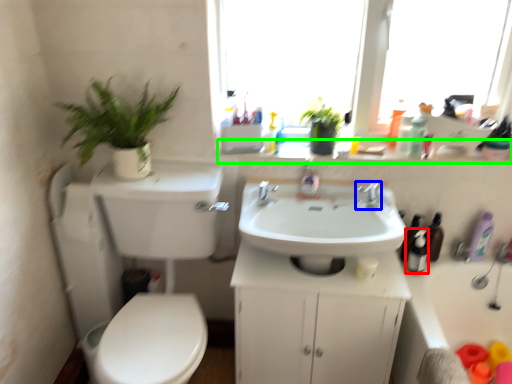
Question: Which object is positioned closest to toiletry (highlighted by a red box)? Select from tap (highlighted by a blue box) and window sill (highlighted by a green box).

Choices:
 (A) tap
 (B) window sill

Answer: (A)